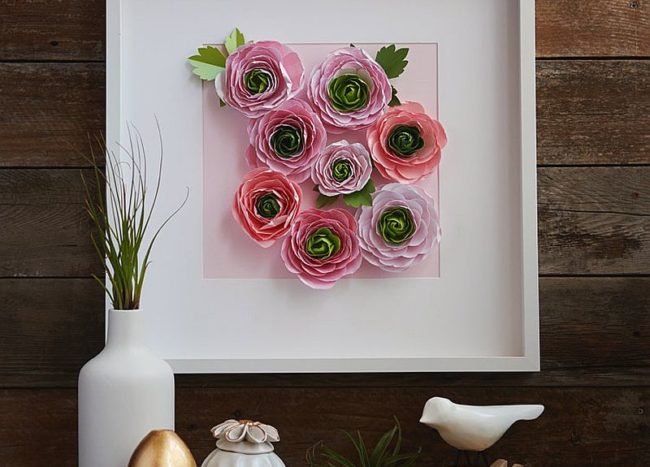
At what (x,y) coordinates should I click in order to perform the action: click on picture frame. Please return your answer as a coordinate pair (x, y). This screenshot has width=650, height=467. Looking at the image, I should click on (523, 370).